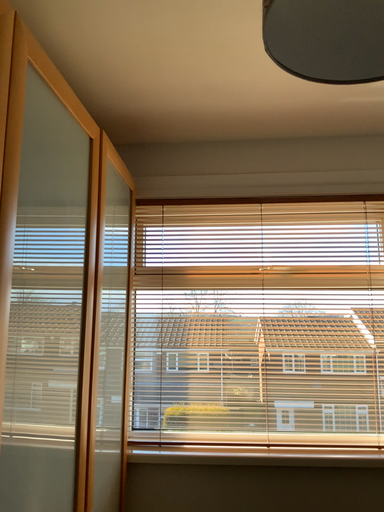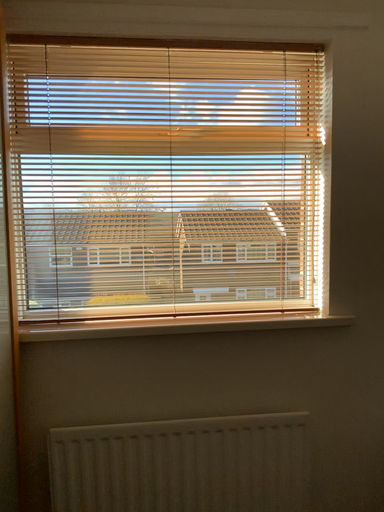
Question: Which way did the camera rotate in the video?

Choices:
 (A) rotated downward
 (B) rotated upward

Answer: (A)